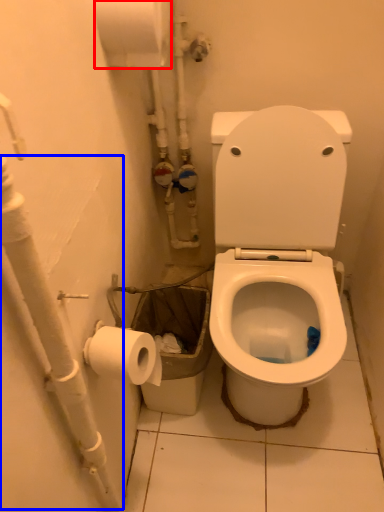
Question: Which point is closer to the camera, toilet paper (highlighted by a red box) or water pipe (highlighted by a blue box)?

Choices:
 (A) toilet paper
 (B) water pipe

Answer: (B)